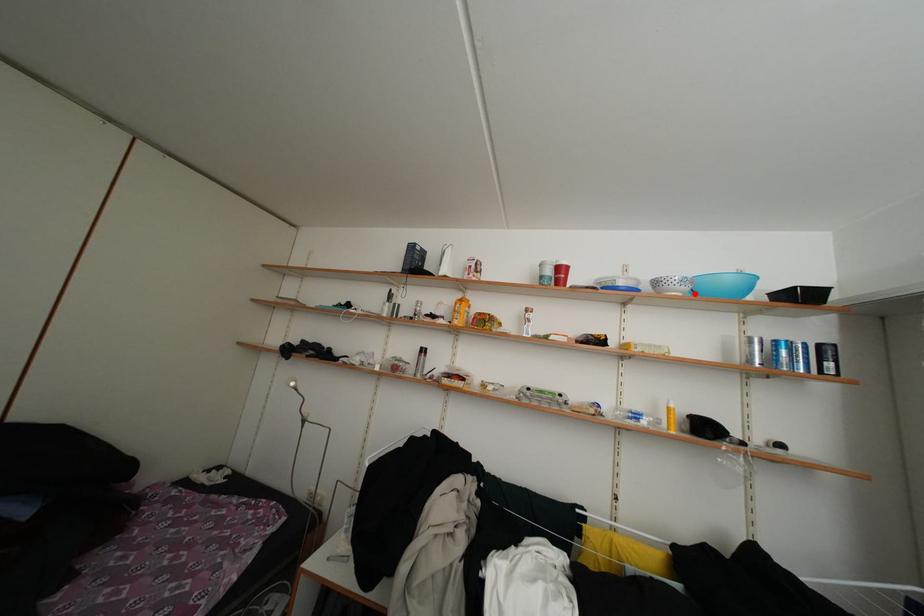
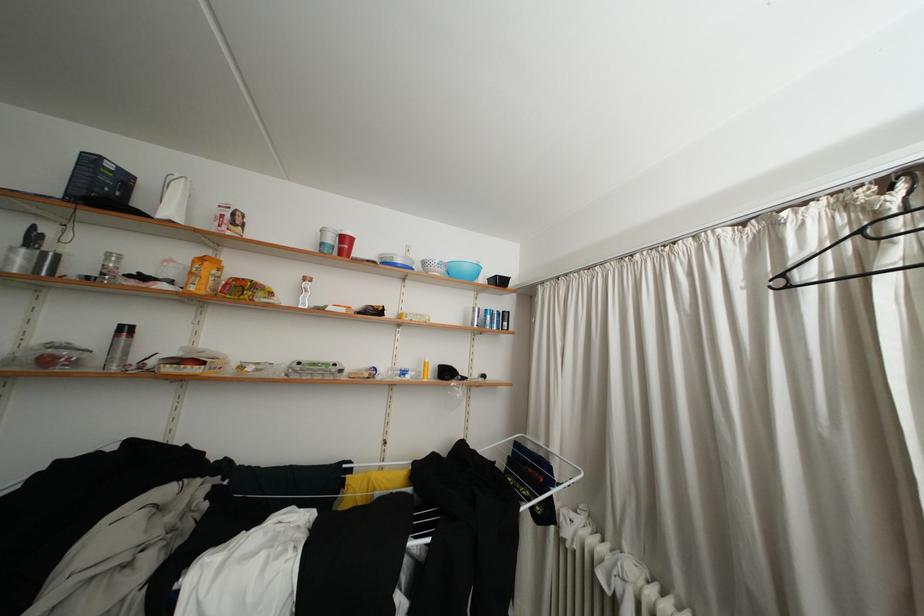
Find the pixel in the second image that matches the highlighted location in the first image.

(451, 276)